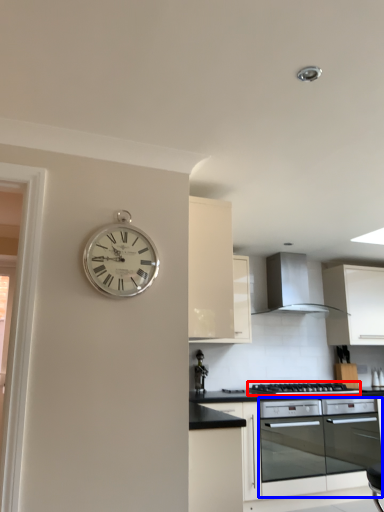
Question: Which object is further to the camera taking this photo, gas stove (highlighted by a red box) or oven (highlighted by a blue box)?

Choices:
 (A) gas stove
 (B) oven

Answer: (A)